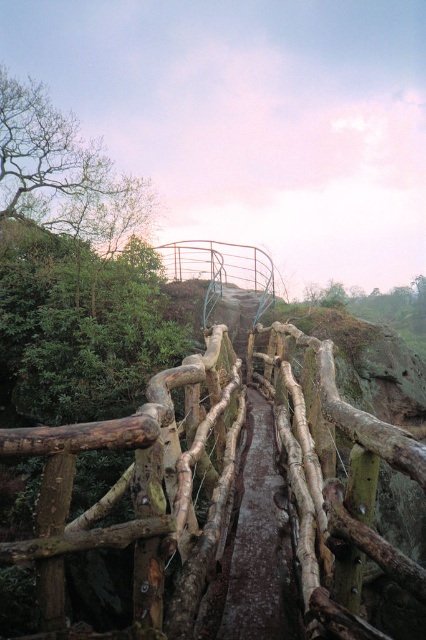
Can you confirm if natural wood fence at center is thinner than brown rough wooden path at center?

Correct, natural wood fence at center's width is less than brown rough wooden path at center's.

Who is higher up, natural wood fence at center or brown rough wooden path at center?

natural wood fence at center is higher up.

Is point (118, 440) positioned after point (253, 566)?

No, it is not.

Identify the location of natural wood fence at center. point(143,493).